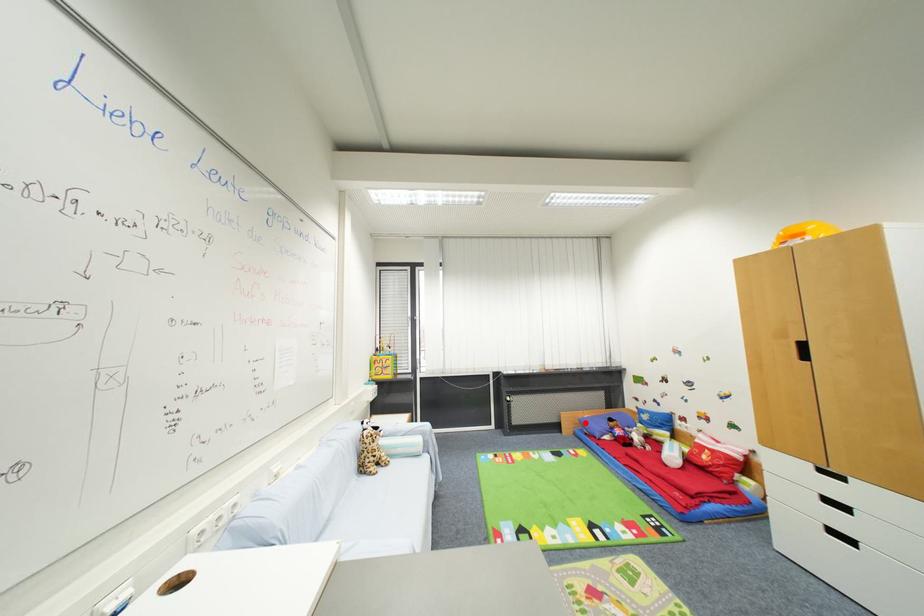
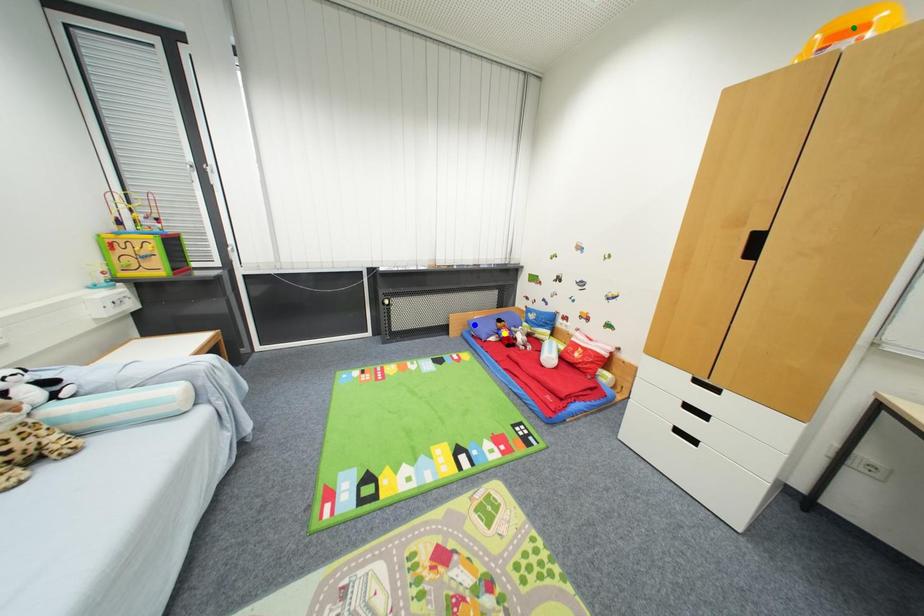
Question: I am providing you with two images of the same scene from different viewpoints. A red point is marked on the first image. You are given multiple points on the second image. Which mark in image 2 goes with the point in image 1?

Choices:
 (A) yellow point
 (B) blue point
 (C) green point

Answer: (B)